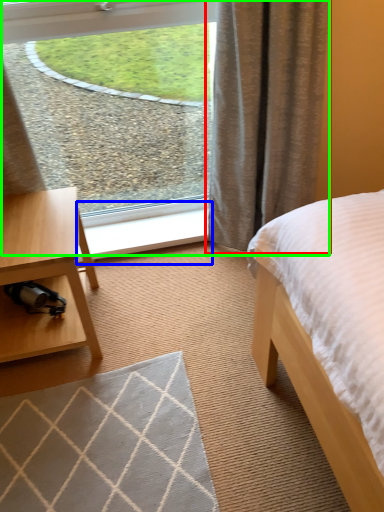
Question: Estimate the real-world distances between objects in this image. Which object is farther from curtain (highlighted by a red box), window sill (highlighted by a blue box) or window (highlighted by a green box)?

Choices:
 (A) window sill
 (B) window

Answer: (A)